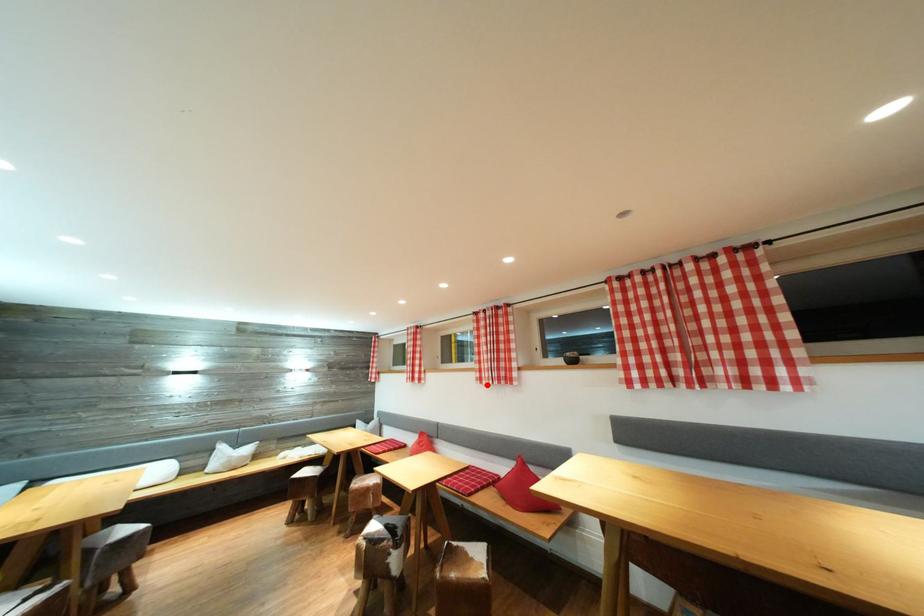
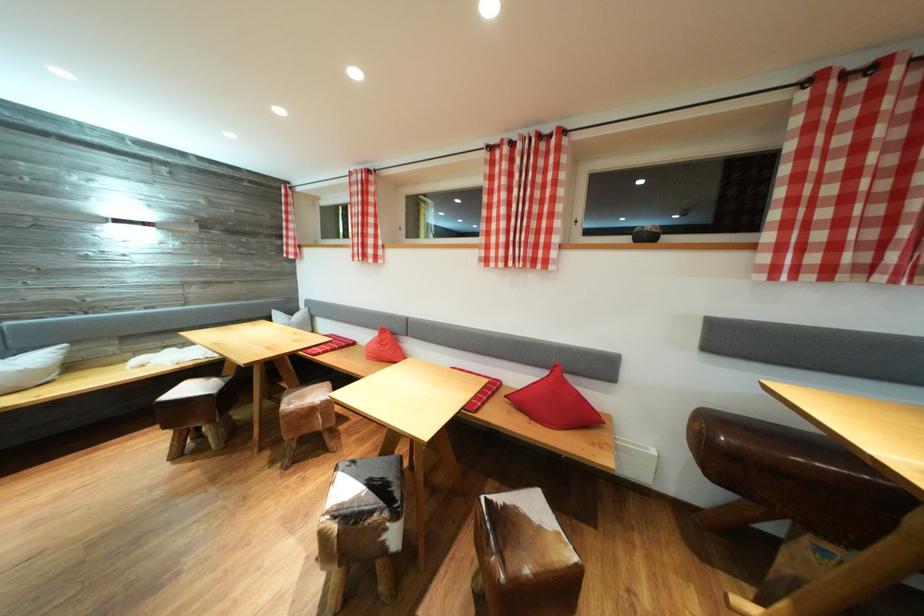
The point at the highlighted location is marked in the first image. Where is the corresponding point in the second image?

(492, 265)